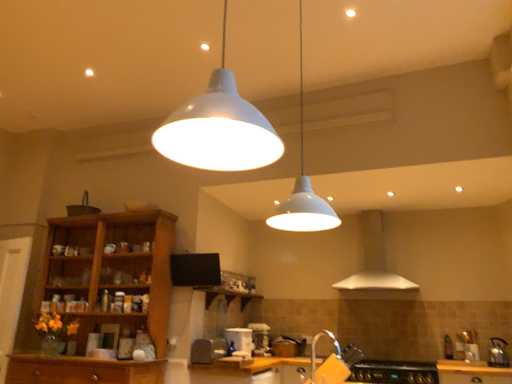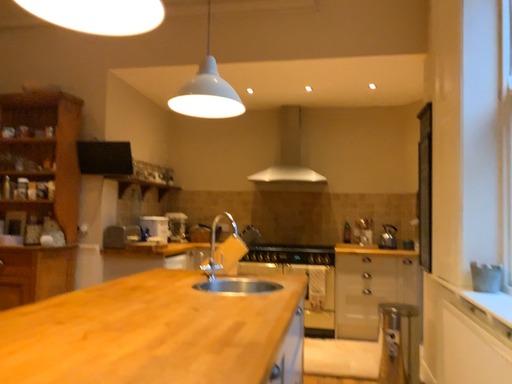
Question: Which way did the camera rotate in the video?

Choices:
 (A) rotated right
 (B) rotated left

Answer: (A)